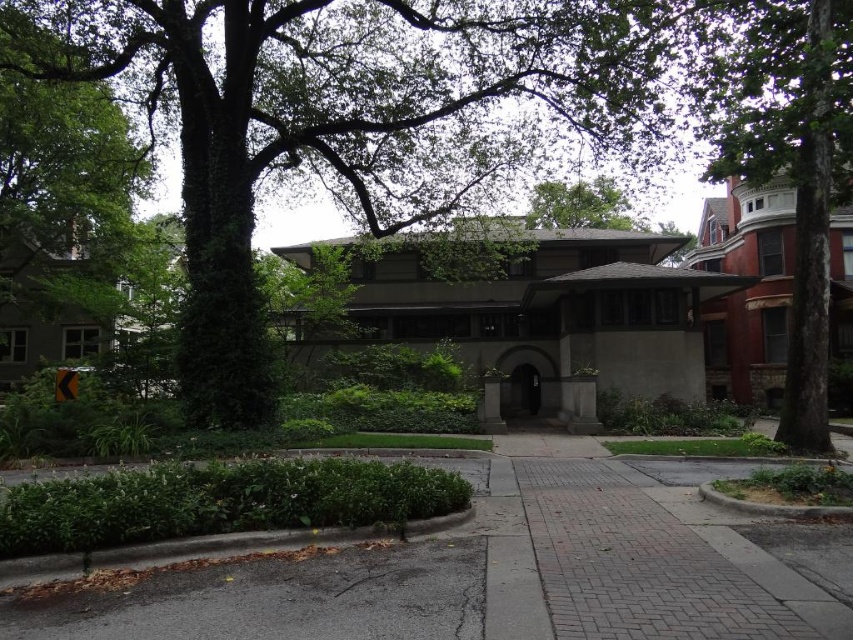
Is brick pavement at center below brick paved sidewalk at center?

No.

Is point (525, 589) positioned behind point (582, 522)?

No, (525, 589) is closer to viewer.

You are a GUI agent. You are given a task and a screenshot of the screen. Output one action in this format:
    pyautogui.click(x=<x>, y=<y>)
    Task: Click on the brick pavement at center
    The height and width of the screenshot is (640, 853).
    Given the screenshot: What is the action you would take?
    pyautogui.click(x=517, y=570)

Does point (572, 449) come behind point (611, 227)?

No, it is in front of (611, 227).

Can you confirm if brick pavement at center is positioned to the right of green leafy tree at upper center?

Incorrect, brick pavement at center is not on the right side of green leafy tree at upper center.

Find the location of a particular element. The width and height of the screenshot is (853, 640). brick pavement at center is located at coordinates (517, 570).

Between point (303, 90) and point (611, 212), which one is positioned behind?

Point (611, 212)

From the picture: Can you confirm if green leafy tree at center is positioned to the left of green leafy tree at upper center?

Yes, green leafy tree at center is to the left of green leafy tree at upper center.

Locate an element on the screen. The image size is (853, 640). green leafy tree at center is located at coordinates (347, 118).